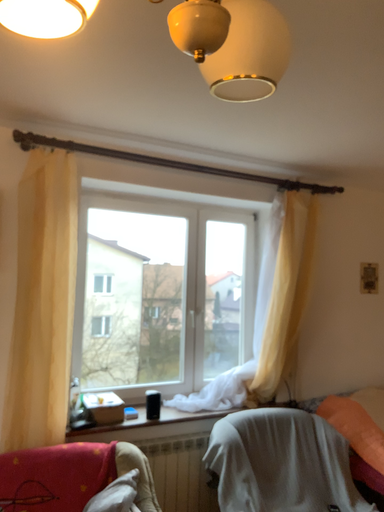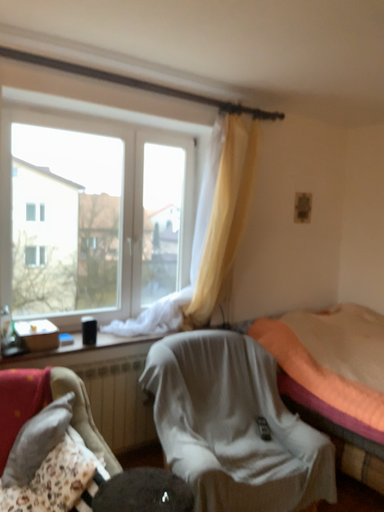
Question: How did the camera likely rotate when shooting the video?

Choices:
 (A) rotated upward
 (B) rotated downward

Answer: (B)